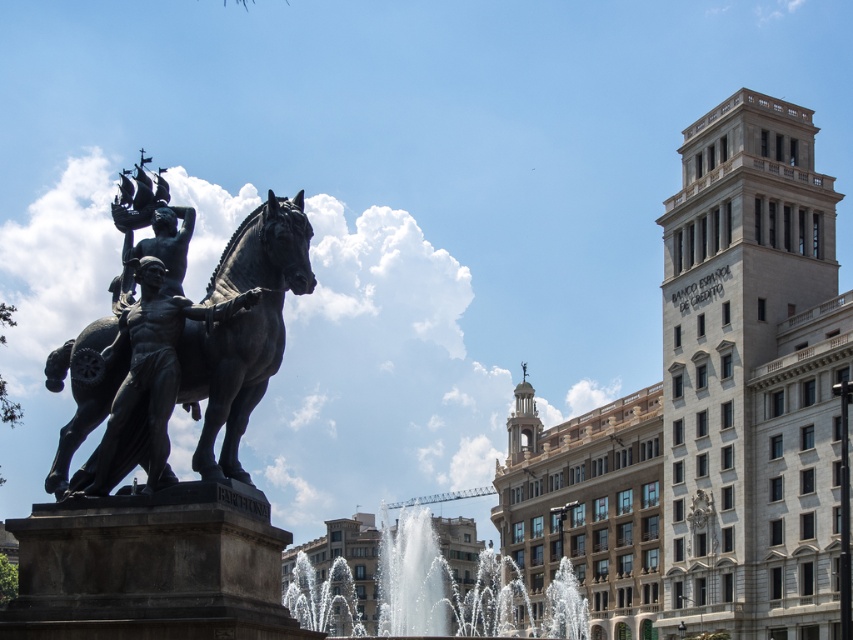
Who is positioned more to the right, beige stone tower at upper right or clear glass water at center?

From the viewer's perspective, beige stone tower at upper right appears more on the right side.

Can you confirm if beige stone tower at upper right is positioned to the left of clear glass water at center?

In fact, beige stone tower at upper right is to the right of clear glass water at center.

I want to click on beige stone tower at upper right, so click(x=751, y=378).

Identify the location of beige stone tower at upper right. (751, 378).

Does beige stone tower at upper right appear over polished bronze horse at center-left?

Incorrect, beige stone tower at upper right is not positioned above polished bronze horse at center-left.

Between point (773, 515) and point (70, 433), which one is positioned behind?

The point (773, 515) is behind.

Find the location of a particular element. The height and width of the screenshot is (640, 853). beige stone tower at upper right is located at coordinates (751, 378).

Which is more to the right, polished bronze horse at center-left or clear glass water at center?

Positioned to the right is clear glass water at center.

Between polished bronze horse at center-left and clear glass water at center, which one is positioned lower?

Positioned lower is clear glass water at center.

Is point (73, 428) in front of point (460, 564)?

Yes, point (73, 428) is in front of point (460, 564).

Locate an element on the screen. polished bronze horse at center-left is located at coordinates (242, 326).